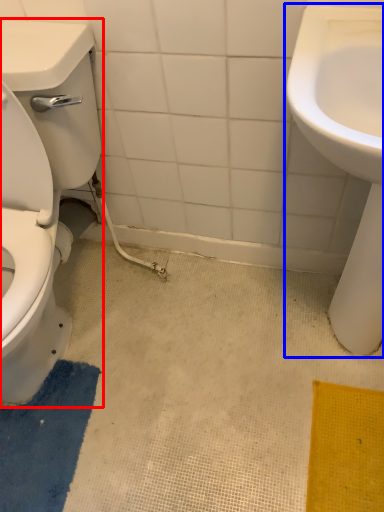
Question: Among these objects, which one is farthest to the camera, porcelain (highlighted by a red box) or sink (highlighted by a blue box)?

Choices:
 (A) porcelain
 (B) sink

Answer: (B)